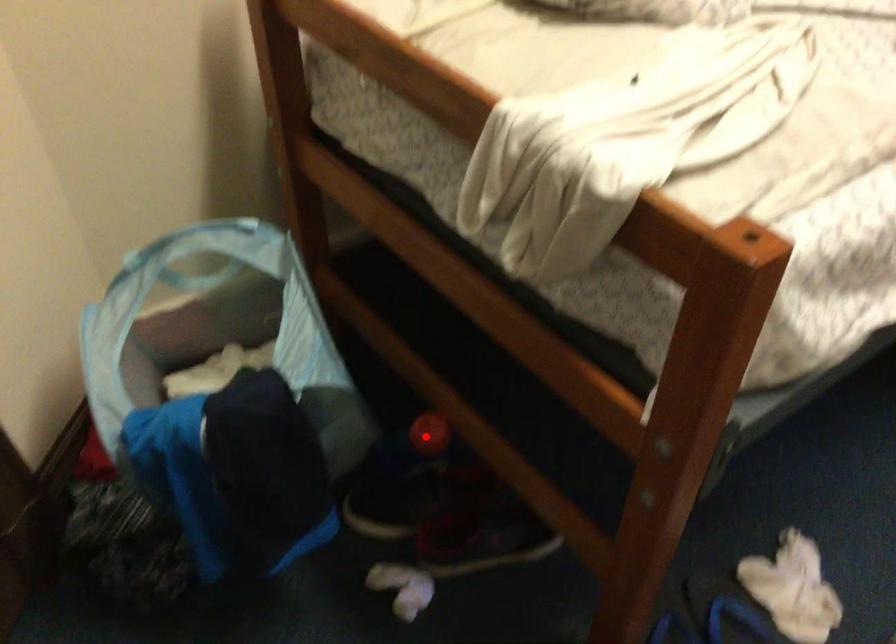
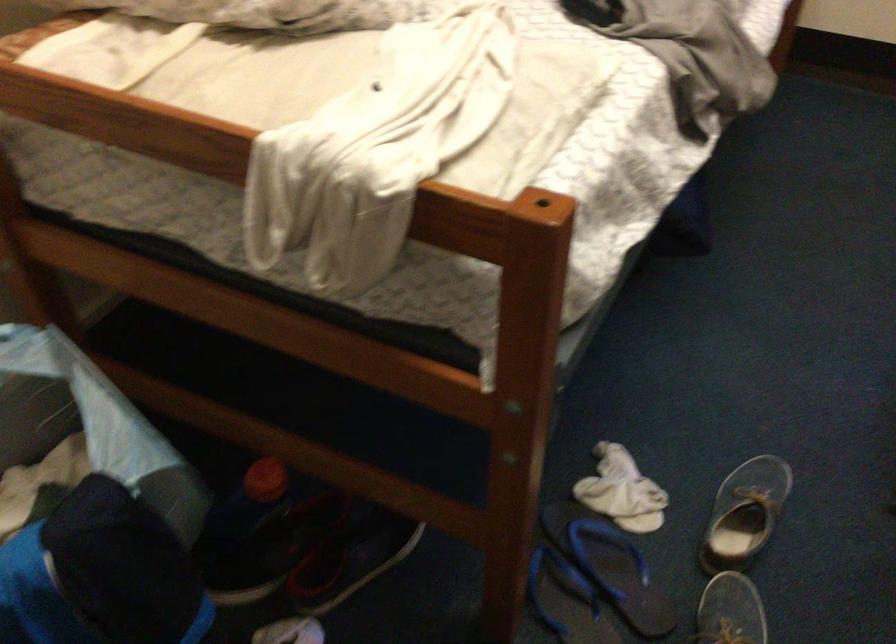
In the second image, find the point that corresponds to the highlighted location in the first image.

(264, 480)